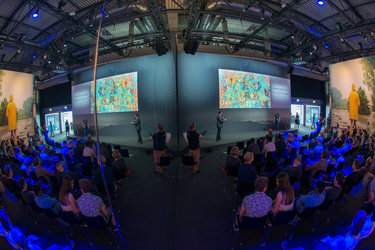
In order to click on screen in this screenshot , I will do `click(22, 100)`, `click(350, 79)`, `click(275, 83)`, `click(106, 102)`.